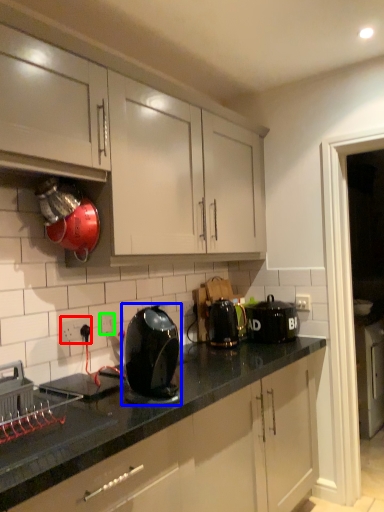
Question: Which is farther away from electric outlet (highlighted by a red box)? kitchen appliance (highlighted by a blue box) or electric outlet (highlighted by a green box)?

Choices:
 (A) kitchen appliance
 (B) electric outlet

Answer: (A)